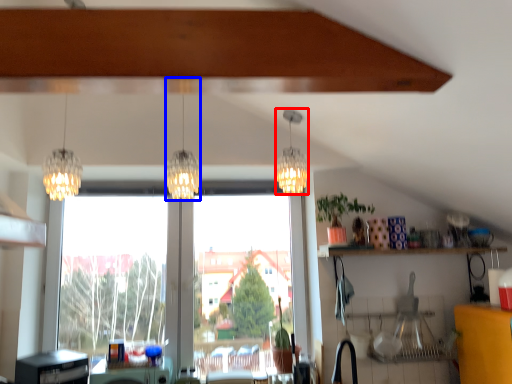
Question: Which object is further to the camera taking this photo, lamp (highlighted by a red box) or lamp (highlighted by a blue box)?

Choices:
 (A) lamp
 (B) lamp

Answer: (A)